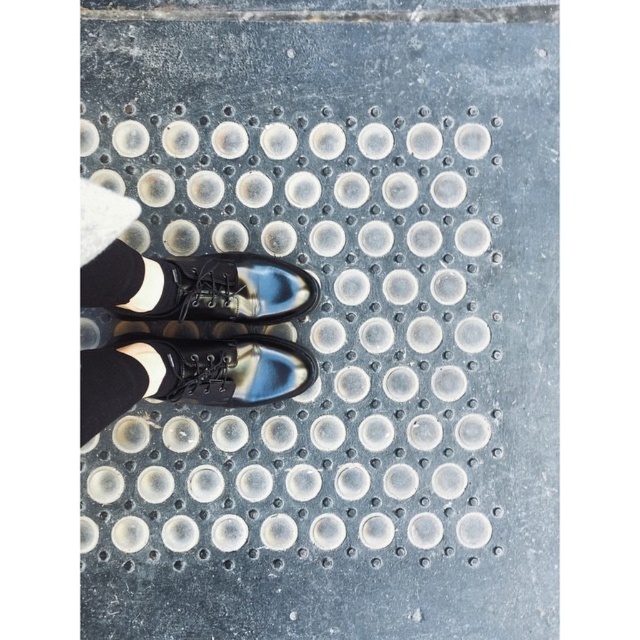
Question: Which object appears closest to the camera in this image?

Choices:
 (A) black leather shoes at center
 (B) shiny black shoes at center
 (C) black wool sock at lower left

Answer: (A)

Question: Estimate the real-world distances between objects in this image. Which object is closer to the black leather shoes at center?

Choices:
 (A) black leather shoe at center
 (B) black wool sock at lower left
 (C) shiny black shoes at center

Answer: (A)

Question: Estimate the real-world distances between objects in this image. Which object is farther from the black leather shoe at center?

Choices:
 (A) black wool sock at lower left
 (B) shiny black shoes at center
 (C) black leather shoes at center

Answer: (A)

Question: Is shiny black shoes at center thinner than black wool sock at lower left?

Choices:
 (A) no
 (B) yes

Answer: (A)

Question: Is shiny black shoes at center in front of black wool sock at lower left?

Choices:
 (A) no
 (B) yes

Answer: (A)

Question: Is black leather shoes at center positioned behind shiny black shoes at center?

Choices:
 (A) yes
 (B) no

Answer: (B)